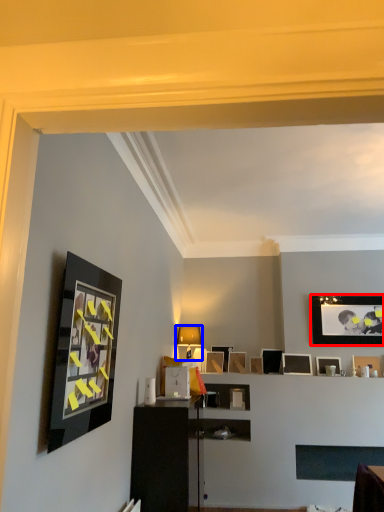
Question: Which object appears farthest to the camera in this image, picture frame (highlighted by a red box) or table lamp (highlighted by a blue box)?

Choices:
 (A) picture frame
 (B) table lamp

Answer: (A)